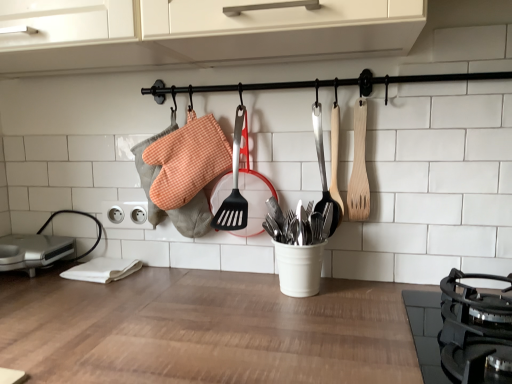
Where is `wooden spatula at right, the 1th spatula when ordered from right to left`? This screenshot has width=512, height=384. wooden spatula at right, the 1th spatula when ordered from right to left is located at coordinates (359, 168).

Measure the distance between silver metallic sandwich maker at lower left and camera.

silver metallic sandwich maker at lower left and camera are 1.06 meters apart.

This screenshot has height=384, width=512. I want to click on orange checkered fabric oven mitts at center, so click(x=187, y=160).

Identify the location of wooden spatula at center, which appears as the first spatula when viewed from the left. The image size is (512, 384). (324, 170).

In the scene shown: Does black matte gas stove at lower right have a greater width compared to orange checkered fabric oven mitts at center?

Yes.

Is black matte gas stove at lower right facing towards orange checkered fabric oven mitts at center?

No, black matte gas stove at lower right does not turn towards orange checkered fabric oven mitts at center.

From the image's perspective, which is below, black matte gas stove at lower right or orange checkered fabric oven mitts at center?

From the image's view, black matte gas stove at lower right is below.

Is black matte gas stove at lower right inside the boundaries of orange checkered fabric oven mitts at center, or outside?

black matte gas stove at lower right cannot be found inside orange checkered fabric oven mitts at center.

Which of these two, white plastic electrical outlet at lower left or wooden spatula at center, which appears as the first spatula when viewed from the left, is smaller?

white plastic electrical outlet at lower left.

Which is in front, white plastic electrical outlet at lower left or wooden spatula at center, which appears as the first spatula when viewed from the left?

wooden spatula at center, which appears as the first spatula when viewed from the left.

Can you confirm if white plastic electrical outlet at lower left is shorter than wooden spatula at center, which appears as the first spatula when viewed from the left?

Yes.

From a real-world perspective, is black matte gas stove at lower right on top of wooden spatula at center, the 2th spatula viewed from the right?

No.

Is wooden spatula at center, the 2th spatula viewed from the right, located within black matte gas stove at lower right?

Actually, wooden spatula at center, the 2th spatula viewed from the right, is outside black matte gas stove at lower right.

There is a black matte gas stove at lower right. What are the coordinates of `the 1st spatula above it (from the image's perspective)` in the screenshot? It's located at (324, 170).

Considering the sizes of objects wooden spatula at center, which appears as the first spatula when viewed from the left, and black matte gas stove at lower right in the image provided, who is thinner, wooden spatula at center, which appears as the first spatula when viewed from the left, or black matte gas stove at lower right?

wooden spatula at center, which appears as the first spatula when viewed from the left.

Is black matte gas stove at lower right at the back of wooden spatula at center, the 2th spatula viewed from the right?

No, wooden spatula at center, the 2th spatula viewed from the right, is not facing the opposite direction of black matte gas stove at lower right.

Is wooden spatula at center, the 2th spatula viewed from the right, spatially inside black matte gas stove at lower right, or outside of it?

wooden spatula at center, the 2th spatula viewed from the right, is spatially situated outside black matte gas stove at lower right.

From a real-world perspective, who is located higher, wooden spatula at center, which appears as the first spatula when viewed from the left, or black matte gas stove at lower right?

In real-world perspective, wooden spatula at center, which appears as the first spatula when viewed from the left, is above.

From the image's perspective, which one is positioned lower, wooden spatula at center, the 2th spatula viewed from the right, or orange checkered fabric oven mitts at center?

wooden spatula at center, the 2th spatula viewed from the right, appears lower in the image.

Is wooden spatula at center, the 2th spatula viewed from the right, with orange checkered fabric oven mitts at center?

No.

Which of these two, wooden spatula at center, the 2th spatula viewed from the right, or orange checkered fabric oven mitts at center, is wider?

orange checkered fabric oven mitts at center.

Image resolution: width=512 pixels, height=384 pixels. In order to click on spatula that is the 2nd object located in front of the silver metallic sandwich maker at lower left in this screenshot , I will do `click(359, 168)`.

From a real-world perspective, who is located higher, silver metallic sandwich maker at lower left or wooden spatula at right, which appears as the 2th spatula when viewed from the left?

In real-world perspective, wooden spatula at right, which appears as the 2th spatula when viewed from the left, is above.

Which object is more forward, silver metallic sandwich maker at lower left or wooden spatula at right, which appears as the 2th spatula when viewed from the left?

Positioned in front is wooden spatula at right, which appears as the 2th spatula when viewed from the left.

Is silver metallic sandwich maker at lower left aimed at wooden spatula at right, the 1th spatula when ordered from right to left?

No, silver metallic sandwich maker at lower left does not turn towards wooden spatula at right, the 1th spatula when ordered from right to left.

Is silver metallic sandwich maker at lower left oriented towards white plastic electrical outlet at lower left?

No.

Is white plastic electrical outlet at lower left completely or partially inside silver metallic sandwich maker at lower left?

Definitely not — white plastic electrical outlet at lower left is not inside silver metallic sandwich maker at lower left.

From a real-world perspective, relative to white plastic electrical outlet at lower left, is silver metallic sandwich maker at lower left vertically above or below?

silver metallic sandwich maker at lower left is below white plastic electrical outlet at lower left.

Consider the image. Is silver metallic sandwich maker at lower left with white plastic electrical outlet at lower left?

silver metallic sandwich maker at lower left and white plastic electrical outlet at lower left are clearly separated.

You are a GUI agent. You are given a task and a screenshot of the screen. Output one action in this format:
    pyautogui.click(x=<x>, y=<y>)
    Task: Click on the material that appears above the black matte gas stove at lower right (from the image's perspective)
    The height and width of the screenshot is (384, 512).
    Given the screenshot: What is the action you would take?
    pyautogui.click(x=187, y=160)

The image size is (512, 384). What are the coordinates of `electric outlet below the wooden spatula at center, which appears as the first spatula when viewed from the left (from the image's perspective)` in the screenshot? It's located at (125, 215).

Considering their positions, is black matte gas stove at lower right positioned closer to wooden spatula at right, the 1th spatula when ordered from right to left, than wooden spatula at center, the 2th spatula viewed from the right?

Based on the image, wooden spatula at center, the 2th spatula viewed from the right, appears to be nearer to wooden spatula at right, the 1th spatula when ordered from right to left.

From the image, which object appears to be farther from orange checkered fabric oven mitts at center, wooden spatula at center, the 2th spatula viewed from the right, or wooden spatula at right, the 1th spatula when ordered from right to left?

wooden spatula at right, the 1th spatula when ordered from right to left, lies further to orange checkered fabric oven mitts at center than the other object.

Based on their spatial positions, is wooden spatula at right, which appears as the 2th spatula when viewed from the left, or black matte gas stove at lower right further from wooden spatula at center, which appears as the first spatula when viewed from the left?

black matte gas stove at lower right is positioned further to the anchor wooden spatula at center, which appears as the first spatula when viewed from the left.

Looking at this image, estimate the real-world distances between objects in this image. Which object is closer to silver metallic sandwich maker at lower left, orange checkered fabric oven mitts at center or wooden spatula at right, which appears as the 2th spatula when viewed from the left?

Among the two, orange checkered fabric oven mitts at center is located nearer to silver metallic sandwich maker at lower left.

Estimate the real-world distances between objects in this image. Which object is further from wooden spatula at center, which appears as the first spatula when viewed from the left, silver metallic sandwich maker at lower left or orange checkered fabric oven mitts at center?

silver metallic sandwich maker at lower left.

Based on their spatial positions, is white plastic electrical outlet at lower left or silver metallic sandwich maker at lower left closer to wooden spatula at right, which appears as the 2th spatula when viewed from the left?

white plastic electrical outlet at lower left.

Considering their positions, is silver metallic sandwich maker at lower left positioned closer to orange checkered fabric oven mitts at center than wooden spatula at center, the 2th spatula viewed from the right?

wooden spatula at center, the 2th spatula viewed from the right, is positioned closer to the anchor orange checkered fabric oven mitts at center.

From the image, which object appears to be farther from white plastic electrical outlet at lower left, wooden spatula at center, the 2th spatula viewed from the right, or silver metallic sandwich maker at lower left?

wooden spatula at center, the 2th spatula viewed from the right.

The height and width of the screenshot is (384, 512). I want to click on spatula between silver metallic sandwich maker at lower left and wooden spatula at right, the 1th spatula when ordered from right to left, in the horizontal direction, so click(324, 170).

Find the location of `electric outlet between silver metallic sandwich maker at lower left and black matte gas stove at lower right`. electric outlet between silver metallic sandwich maker at lower left and black matte gas stove at lower right is located at coordinates (125, 215).

I want to click on spatula between black matte gas stove at lower right and wooden spatula at center, the 2th spatula viewed from the right, from front to back, so click(359, 168).

Locate an element on the screen. electric outlet between silver metallic sandwich maker at lower left and orange checkered fabric oven mitts at center from left to right is located at coordinates (125, 215).